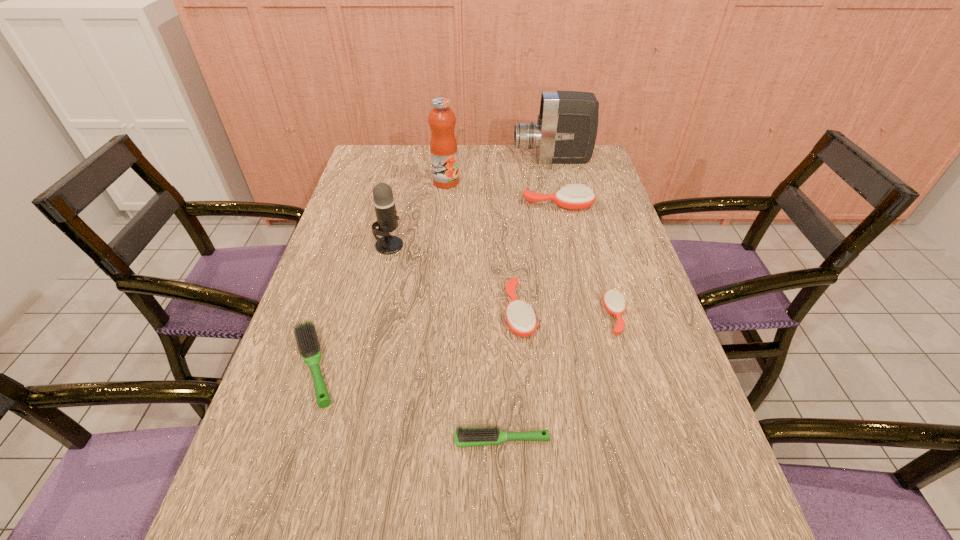
The width and height of the screenshot is (960, 540). Identify the location of vacant area that lies between the microphone and the leftmost orange hairbrush. (454, 279).

Where is `free spot between the fourth shortest object and the shortest object`? free spot between the fourth shortest object and the shortest object is located at coordinates (511, 376).

Identify which object is located as the third nearest to the smaller light hairbrush. Please provide its 2D coordinates. Your answer should be formatted as a tuple, i.e. [(x, y)], where the tuple contains the x and y coordinates of a point satisfying the conditions above.

[(614, 303)]

Where is `object identified as the fourth closest to the tallest hairbrush`? object identified as the fourth closest to the tallest hairbrush is located at coordinates (614, 303).

Identify which hairbrush is the third closest to the fruit juice. Please provide its 2D coordinates. Your answer should be formatted as a tuple, i.e. [(x, y)], where the tuple contains the x and y coordinates of a point satisfying the conditions above.

[(307, 339)]

Find the location of a particular element. The width and height of the screenshot is (960, 540). hairbrush that is the fourth closest to the fourth farthest object is located at coordinates (614, 303).

You are a GUI agent. You are given a task and a screenshot of the screen. Output one action in this format:
    pyautogui.click(x=<x>, y=<y>)
    Task: Click on the orange hairbrush that is the second closest one to the bigger light hairbrush
    
    Given the screenshot: What is the action you would take?
    pyautogui.click(x=614, y=303)

Choose which orange hairbrush is the second nearest neighbor to the nearest object. Please provide its 2D coordinates. Your answer should be formatted as a tuple, i.e. [(x, y)], where the tuple contains the x and y coordinates of a point satisfying the conditions above.

[(614, 303)]

Identify which light hairbrush is the second nearest to the sixth nearest object. Please provide its 2D coordinates. Your answer should be formatted as a tuple, i.e. [(x, y)], where the tuple contains the x and y coordinates of a point satisfying the conditions above.

[(464, 437)]

Locate an element on the screen. The width and height of the screenshot is (960, 540). the second closest light hairbrush to the fifth shortest object is located at coordinates (464, 437).